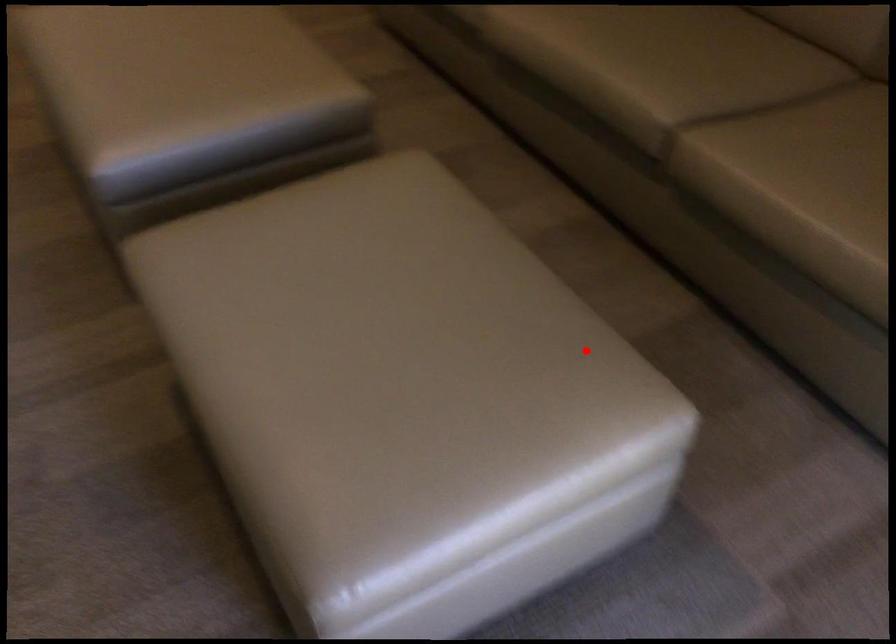
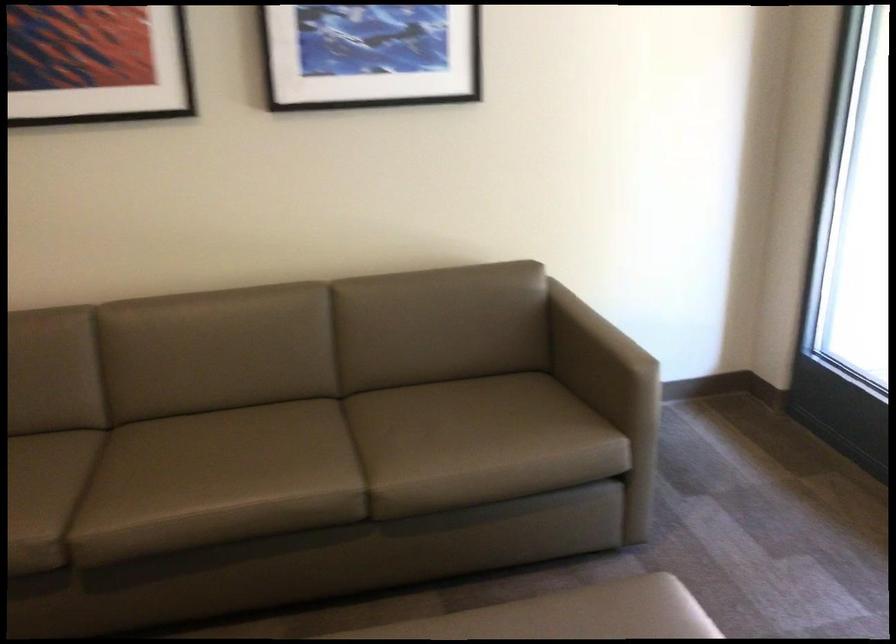
Where in the second image is the point corresponding to the highlighted location from the first image?

(597, 618)